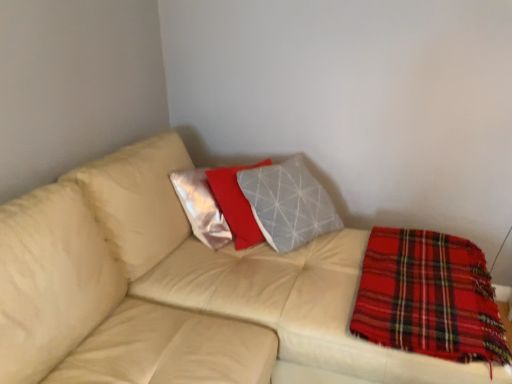
Question: Is beige leather couch at center facing towards red plaid blanket at lower right?

Choices:
 (A) yes
 (B) no

Answer: (A)

Question: Would you consider beige leather couch at center to be distant from red plaid blanket at lower right?

Choices:
 (A) no
 (B) yes

Answer: (A)

Question: From a real-world perspective, is beige leather couch at center located higher than red plaid blanket at lower right?

Choices:
 (A) yes
 (B) no

Answer: (B)

Question: Considering the relative positions of beige leather couch at center and red plaid blanket at lower right in the image provided, is beige leather couch at center to the left of red plaid blanket at lower right from the viewer's perspective?

Choices:
 (A) no
 (B) yes

Answer: (B)

Question: Considering the relative sizes of beige leather couch at center and red plaid blanket at lower right in the image provided, is beige leather couch at center wider than red plaid blanket at lower right?

Choices:
 (A) no
 (B) yes

Answer: (B)

Question: From the image's perspective, is beige leather couch at center beneath red plaid blanket at lower right?

Choices:
 (A) no
 (B) yes

Answer: (A)

Question: Is red plaid blanket at lower right far from beige leather couch at center?

Choices:
 (A) yes
 (B) no

Answer: (B)

Question: Considering the relative positions of red plaid blanket at lower right and beige leather couch at center in the image provided, is red plaid blanket at lower right to the left of beige leather couch at center from the viewer's perspective?

Choices:
 (A) yes
 (B) no

Answer: (B)

Question: Can you confirm if red plaid blanket at lower right is thinner than beige leather couch at center?

Choices:
 (A) no
 (B) yes

Answer: (B)

Question: Would you say red plaid blanket at lower right contains beige leather couch at center?

Choices:
 (A) no
 (B) yes

Answer: (A)

Question: Does red plaid blanket at lower right have a smaller size compared to beige leather couch at center?

Choices:
 (A) yes
 (B) no

Answer: (A)

Question: Is red plaid blanket at lower right in front of beige leather couch at center?

Choices:
 (A) yes
 (B) no

Answer: (B)

Question: From the image's perspective, relative to red plaid blanket at lower right, is beige leather couch at center above or below?

Choices:
 (A) below
 (B) above

Answer: (B)